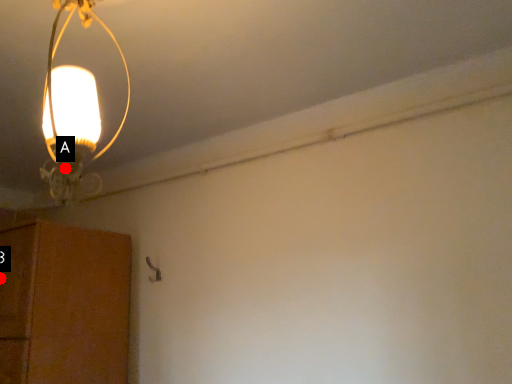
Question: Two points are circled on the image, labeled by A and B beside each circle. Which of the following is the farthest from the observer?

Choices:
 (A) A is further
 (B) B is further

Answer: (B)